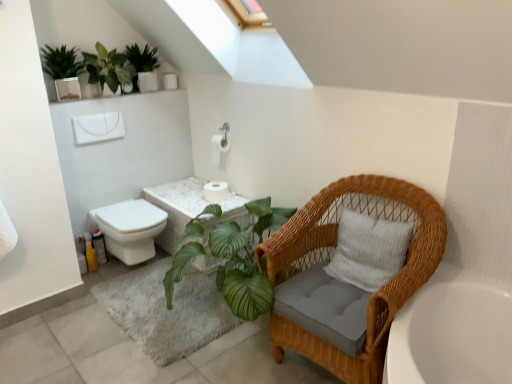
Question: From a real-world perspective, is woven wicker chair at right on top of white wicker vanity at center?

Choices:
 (A) yes
 (B) no

Answer: (A)

Question: Is woven wicker chair at right aimed at white wicker vanity at center?

Choices:
 (A) yes
 (B) no

Answer: (B)

Question: From the image's perspective, is woven wicker chair at right located above white wicker vanity at center?

Choices:
 (A) yes
 (B) no

Answer: (B)

Question: Does woven wicker chair at right appear on the right side of white wicker vanity at center?

Choices:
 (A) no
 (B) yes

Answer: (B)

Question: From the image's perspective, is woven wicker chair at right located beneath white wicker vanity at center?

Choices:
 (A) no
 (B) yes

Answer: (B)

Question: From a real-world perspective, is white matte toilet paper at center, placed as the second toilet paper when sorted from top to bottom, above or below green leafy plant at upper left, placed as the second houseplant when sorted from left to right?

Choices:
 (A) below
 (B) above

Answer: (A)

Question: Relative to green leafy plant at upper left, marked as the 2th houseplant in a right-to-left arrangement, is white matte toilet paper at center, arranged as the 1th toilet paper when ordered from the bottom, in front or behind?

Choices:
 (A) behind
 (B) front

Answer: (A)

Question: Is white matte toilet paper at center, placed as the second toilet paper when sorted from top to bottom, inside the boundaries of green leafy plant at upper left, placed as the second houseplant when sorted from left to right, or outside?

Choices:
 (A) inside
 (B) outside

Answer: (B)

Question: Considering the positions of white matte toilet paper at center, arranged as the 1th toilet paper when ordered from the bottom, and green leafy plant at upper left, marked as the 2th houseplant in a right-to-left arrangement, in the image, is white matte toilet paper at center, arranged as the 1th toilet paper when ordered from the bottom, bigger or smaller than green leafy plant at upper left, marked as the 2th houseplant in a right-to-left arrangement,?

Choices:
 (A) big
 (B) small

Answer: (B)

Question: Considering the positions of green matte plant at upper left, which ranks as the 1th houseplant in left-to-right order, and white matte toilet paper at center, the 1th toilet paper positioned from the top, in the image, is green matte plant at upper left, which ranks as the 1th houseplant in left-to-right order, bigger or smaller than white matte toilet paper at center, the 1th toilet paper positioned from the top,?

Choices:
 (A) small
 (B) big

Answer: (B)

Question: From a real-world perspective, is green matte plant at upper left, which ranks as the 1th houseplant in left-to-right order, physically located above or below white matte toilet paper at center, which is counted as the 2th toilet paper, starting from the bottom?

Choices:
 (A) below
 (B) above

Answer: (B)

Question: Is green matte plant at upper left, which ranks as the 3th houseplant in right-to-left order, spatially inside white matte toilet paper at center, which is counted as the 2th toilet paper, starting from the bottom, or outside of it?

Choices:
 (A) inside
 (B) outside

Answer: (B)

Question: Does point (61, 77) appear closer or farther from the camera than point (217, 144)?

Choices:
 (A) closer
 (B) farther

Answer: (A)

Question: From the image's perspective, relative to green matte plant at upper left, which ranks as the 1th houseplant in left-to-right order, is white matte toilet paper at center, the 1th toilet paper positioned from the top, above or below?

Choices:
 (A) above
 (B) below

Answer: (B)

Question: Based on their sizes in the image, would you say white matte toilet paper at center, which is counted as the 2th toilet paper, starting from the bottom, is bigger or smaller than green matte plant at upper left, which ranks as the 1th houseplant in left-to-right order?

Choices:
 (A) small
 (B) big

Answer: (A)